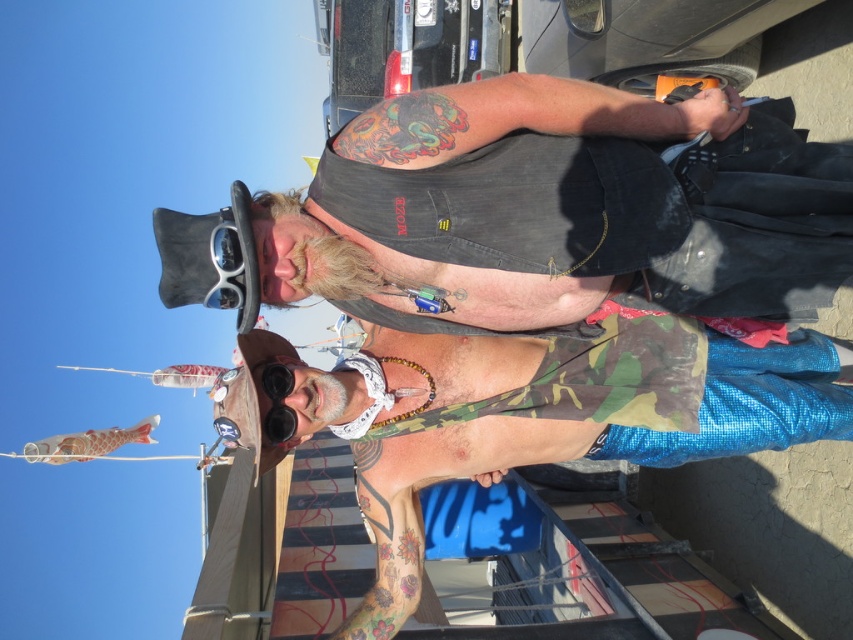
You are a fashion designer who wants to place a new accessory on the camo fabric tank top at center. Where exactly should you place it?

The camo fabric tank top at center is located at point (x=534, y=416), so you should place the accessory there.

You are a fashion designer observing the two people in the image. You need to determine which clothing item, the denim vest at center or the black rubber goggles at center, is placed higher on the body. Which one is higher?

The denim vest at center is positioned over the black rubber goggles at center, so the denim vest at center is higher on the body.

You are an observer standing in front of the image. You notice the denim vest at center. Can you determine its exact position using the coordinate system provided?

The denim vest at center is located at point (555, 211) according to the coordinate system provided.